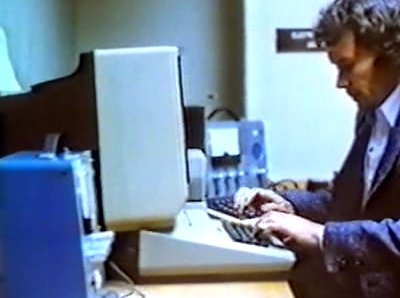
I want to click on speaker, so click(x=257, y=145).